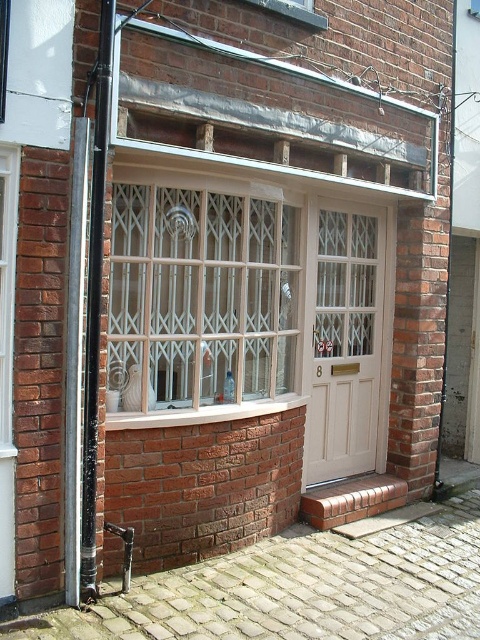
Does point (156, 356) come behind point (303, 472)?

No, it is in front of (303, 472).

Which is in front, point (156, 372) or point (360, 429)?

Point (156, 372) is more forward.

Identify the location of clear glass window at center. (200, 298).

The height and width of the screenshot is (640, 480). Identify the location of clear glass window at center. (200, 298).

In the scene shown: Does white wooden door at center lie in front of white glass window at left?

No, it is not.

Is white wooden door at center taller than white glass window at left?

Yes.

Is point (348, 237) farther from camera compared to point (12, 321)?

Yes.

I want to click on white wooden door at center, so pyautogui.click(x=346, y=342).

From the picture: Who is taller, clear glass window at center or white glass window at left?

With more height is white glass window at left.

Is clear glass window at center further to the viewer compared to white glass window at left?

Yes, clear glass window at center is behind white glass window at left.

Locate an element on the screen. clear glass window at center is located at coordinates (200, 298).